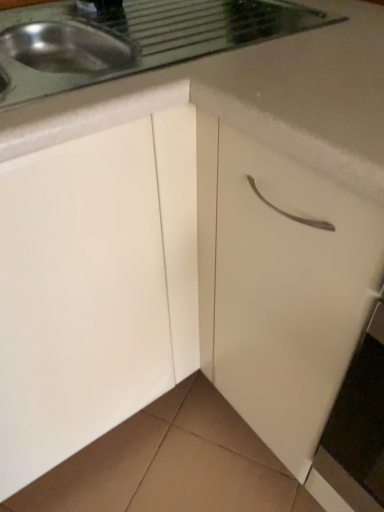
Question: Should I look upward or downward to see white matte drawer at center?

Choices:
 (A) up
 (B) down

Answer: (B)

Question: Does white matte drawer at center appear on the left side of white glossy countertop at upper center?

Choices:
 (A) yes
 (B) no

Answer: (B)

Question: From a real-world perspective, is white matte drawer at center positioned over white glossy countertop at upper center based on gravity?

Choices:
 (A) yes
 (B) no

Answer: (B)

Question: Is white matte drawer at center with white glossy countertop at upper center?

Choices:
 (A) yes
 (B) no

Answer: (B)

Question: Can you confirm if white matte drawer at center is taller than white glossy countertop at upper center?

Choices:
 (A) yes
 (B) no

Answer: (A)

Question: Is white matte drawer at center at the right side of white glossy countertop at upper center?

Choices:
 (A) no
 (B) yes

Answer: (B)

Question: Is white matte drawer at center completely or partially outside of white glossy countertop at upper center?

Choices:
 (A) yes
 (B) no

Answer: (A)

Question: Is white glossy countertop at upper center not near white matte drawer at center?

Choices:
 (A) yes
 (B) no

Answer: (B)

Question: Considering the relative sizes of white glossy countertop at upper center and white matte drawer at center in the image provided, is white glossy countertop at upper center wider than white matte drawer at center?

Choices:
 (A) no
 (B) yes

Answer: (B)

Question: Considering the relative sizes of white glossy countertop at upper center and white matte drawer at center in the image provided, is white glossy countertop at upper center thinner than white matte drawer at center?

Choices:
 (A) yes
 (B) no

Answer: (B)

Question: Is white glossy countertop at upper center turned away from white matte drawer at center?

Choices:
 (A) yes
 (B) no

Answer: (B)

Question: From the image's perspective, is white glossy countertop at upper center over white matte drawer at center?

Choices:
 (A) yes
 (B) no

Answer: (A)

Question: Does white glossy countertop at upper center come in front of white matte drawer at center?

Choices:
 (A) no
 (B) yes

Answer: (A)

Question: Considering the positions of white matte drawer at center and white glossy countertop at upper center in the image, is white matte drawer at center bigger or smaller than white glossy countertop at upper center?

Choices:
 (A) small
 (B) big

Answer: (B)